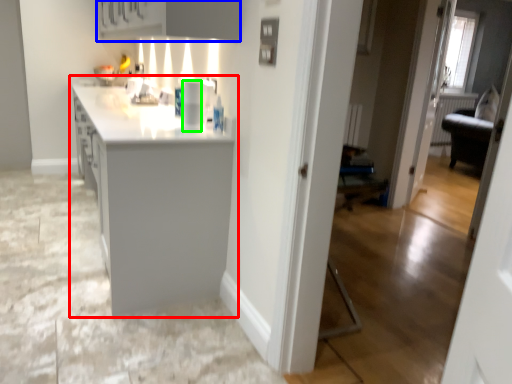
Question: Estimate the real-world distances between objects in this image. Which object is farther from countertop (highlighted by a red box), cabinetry (highlighted by a blue box) or appliance (highlighted by a green box)?

Choices:
 (A) cabinetry
 (B) appliance

Answer: (A)